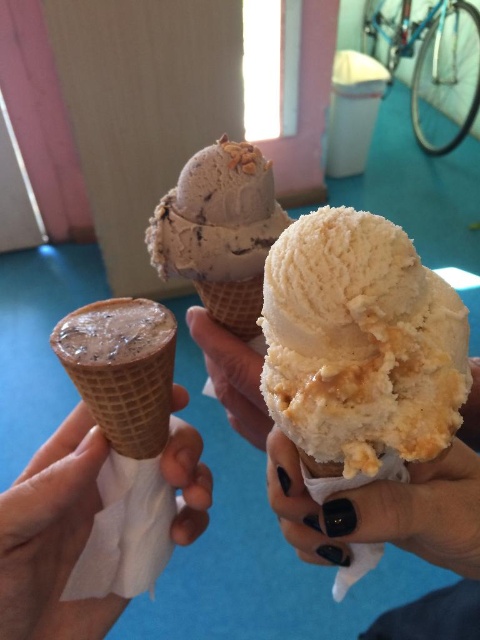
You are holding a camera and want to take a photo of the point at coordinates (x=31, y=484). If the camera is 26.55 inches away from this point, is the camera close enough to capture the point clearly in the photo?

The point at coordinates (x=31, y=484) is 26.55 inches away from the camera, so yes, the camera is close enough to capture the point clearly in the photo.

You are holding a brown waffle cone at center and a chocolate chip ice cream at center. Which object is closer to your hand?

The brown waffle cone at center is closer to your hand because it is positioned closer to the viewer than the chocolate chip ice cream at center.

In the scene shown: You are at an ice cream shop and see two cones in the image. The brown waffle cone at center and the chocolate waffle cone at left. Which one is positioned more to the right?

The chocolate waffle cone at left is positioned more to the right because the brown waffle cone at center is to the left of it.